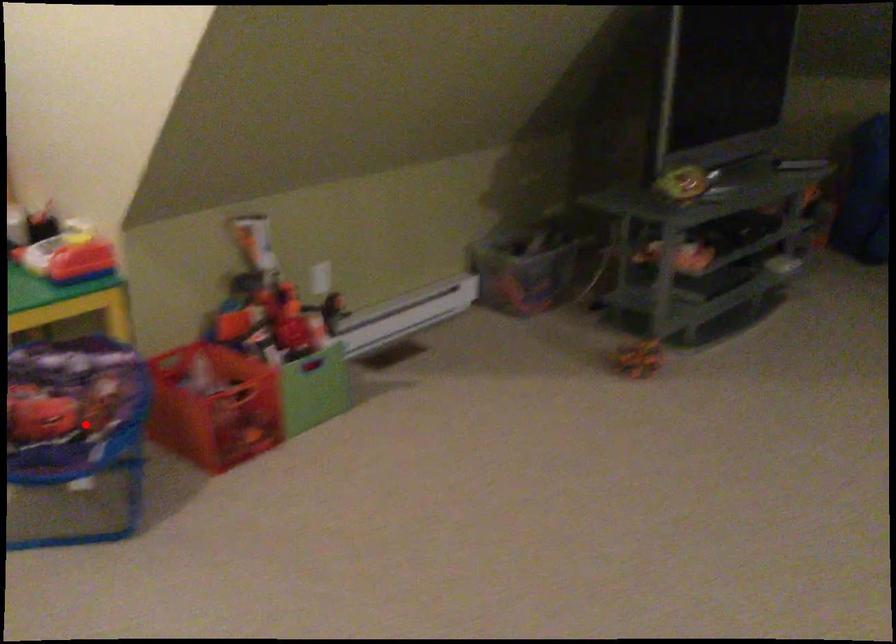
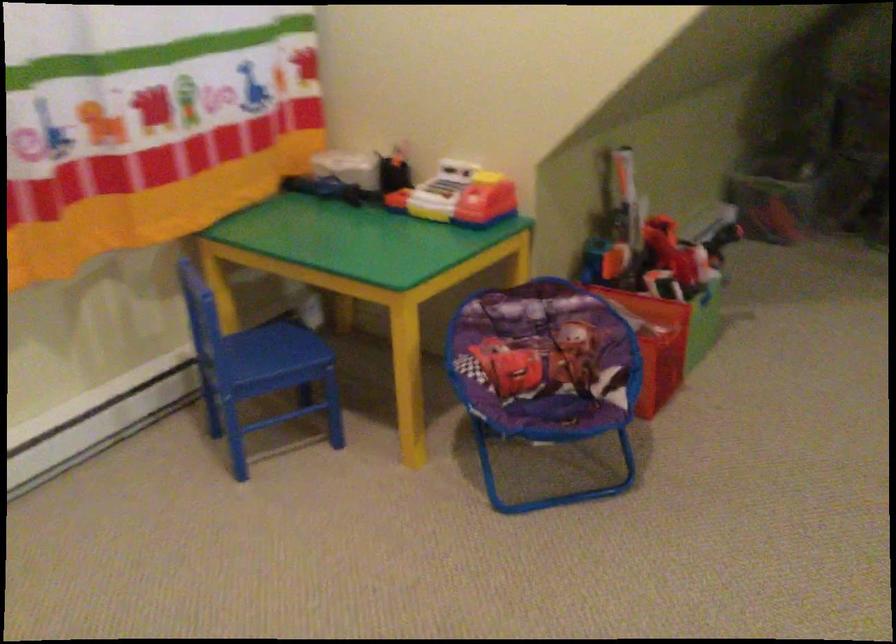
Where in the second image is the point corresponding to the highlighted location from the first image?

(546, 372)